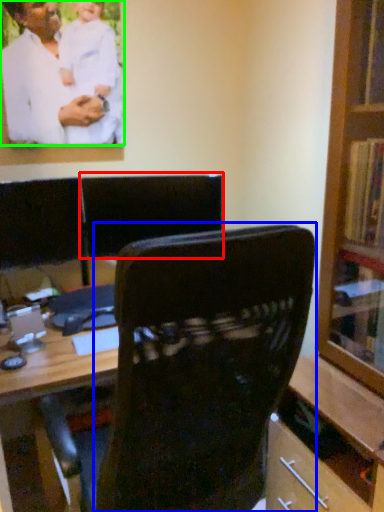
Question: Which object is positioned farthest from armchair (highlighted by a red box)? Select from chair (highlighted by a blue box) and man (highlighted by a green box).

Choices:
 (A) chair
 (B) man

Answer: (A)